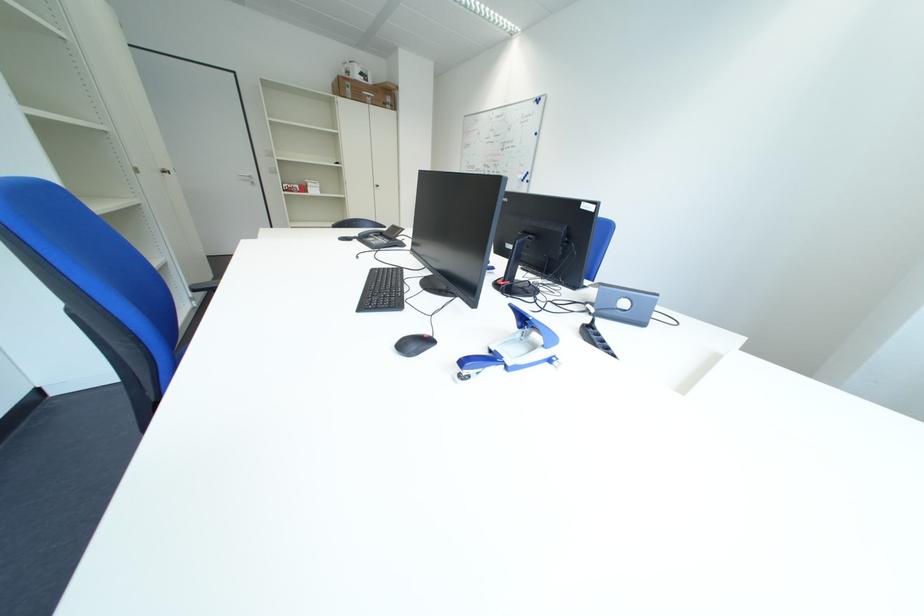
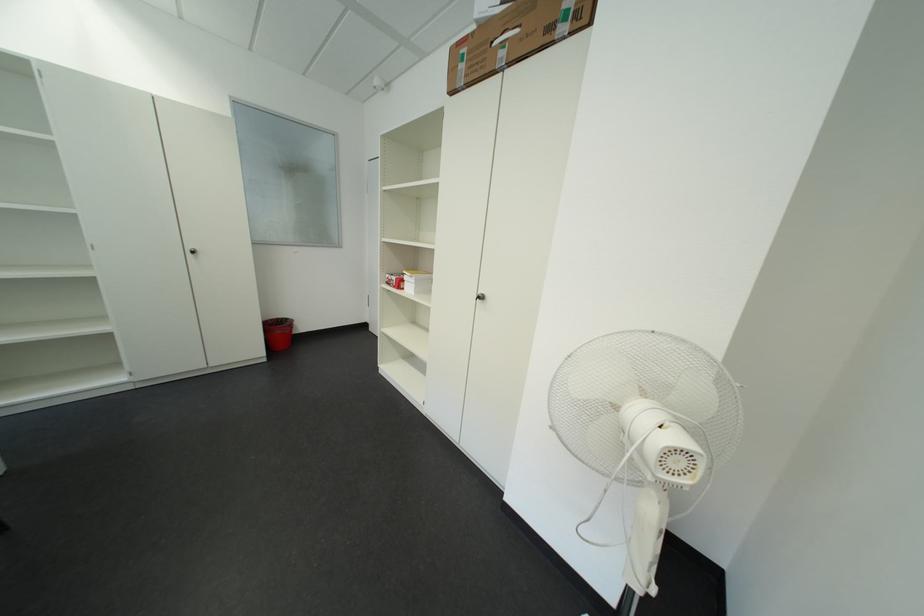
Locate, in the second image, the point that corresponds to (x=317, y=191) in the first image.

(411, 286)